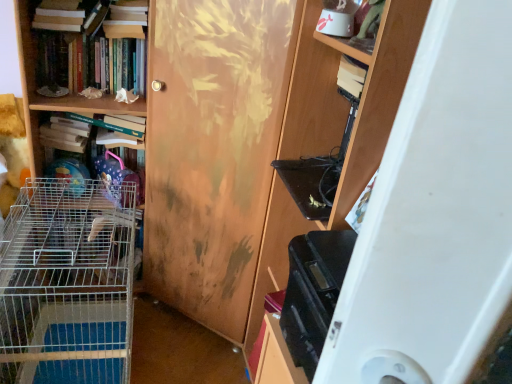
Question: Does hardcover books at upper left, positioned as the 2th book in bottom-to-top order, have a smaller size compared to wooden door at center?

Choices:
 (A) yes
 (B) no

Answer: (A)

Question: Does hardcover books at upper left, which is the 2th book from top to bottom, have a lesser height compared to wooden door at center?

Choices:
 (A) no
 (B) yes

Answer: (B)

Question: Is hardcover books at upper left, which is the 2th book from top to bottom, oriented away from wooden door at center?

Choices:
 (A) no
 (B) yes

Answer: (A)

Question: Considering the relative sizes of hardcover books at upper left, positioned as the 2th book in bottom-to-top order, and wooden door at center in the image provided, is hardcover books at upper left, positioned as the 2th book in bottom-to-top order, taller than wooden door at center?

Choices:
 (A) yes
 (B) no

Answer: (B)

Question: From the image's perspective, is hardcover books at upper left, positioned as the 2th book in bottom-to-top order, over wooden door at center?

Choices:
 (A) no
 (B) yes

Answer: (B)

Question: Does point coord(75,9) appear closer or farther from the camera than point coord(34,157)?

Choices:
 (A) farther
 (B) closer

Answer: (B)

Question: Looking at their shapes, would you say matte white book at upper left, positioned as the 3th book in bottom-to-top order, is wider or thinner than metal wire cage at left?

Choices:
 (A) wide
 (B) thin

Answer: (B)

Question: Is matte white book at upper left, which appears as the first book when viewed from the top, inside or outside of metal wire cage at left?

Choices:
 (A) inside
 (B) outside

Answer: (A)

Question: From a real-world perspective, is matte white book at upper left, which appears as the first book when viewed from the top, physically located above or below metal wire cage at left?

Choices:
 (A) above
 (B) below

Answer: (A)

Question: From a real-world perspective, is metal wire cage at left above or below silver wire cage at left?

Choices:
 (A) above
 (B) below

Answer: (A)

Question: Would you say metal wire cage at left is to the left or to the right of silver wire cage at left in the picture?

Choices:
 (A) right
 (B) left

Answer: (B)

Question: Which is correct: metal wire cage at left is inside silver wire cage at left, or outside of it?

Choices:
 (A) outside
 (B) inside

Answer: (A)

Question: Considering the positions of metal wire cage at left and silver wire cage at left in the image, is metal wire cage at left wider or thinner than silver wire cage at left?

Choices:
 (A) wide
 (B) thin

Answer: (B)

Question: From their relative heights in the image, would you say silver wire cage at left is taller or shorter than matte white book at upper left, which appears as the first book when viewed from the top?

Choices:
 (A) tall
 (B) short

Answer: (A)

Question: Is silver wire cage at left inside or outside of matte white book at upper left, which appears as the first book when viewed from the top?

Choices:
 (A) inside
 (B) outside

Answer: (B)